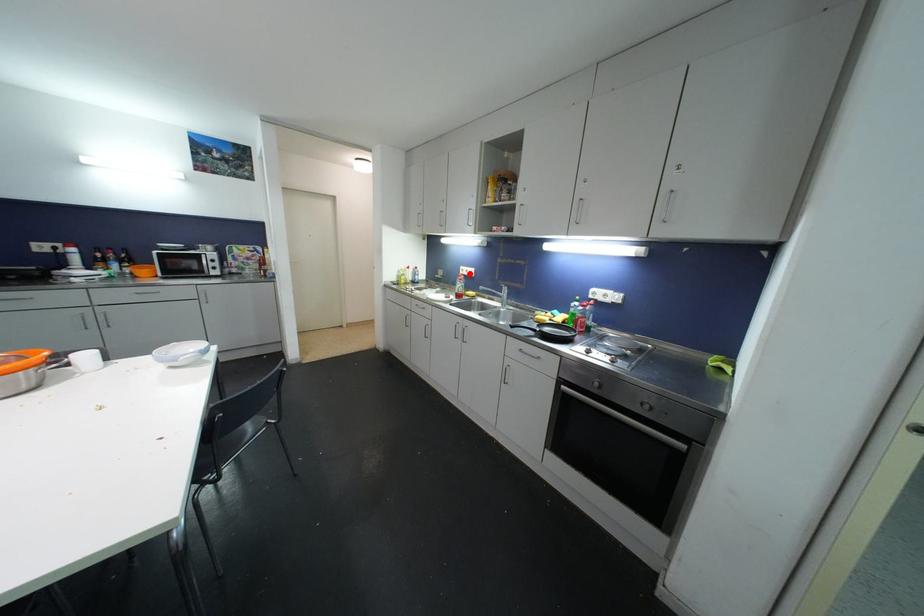
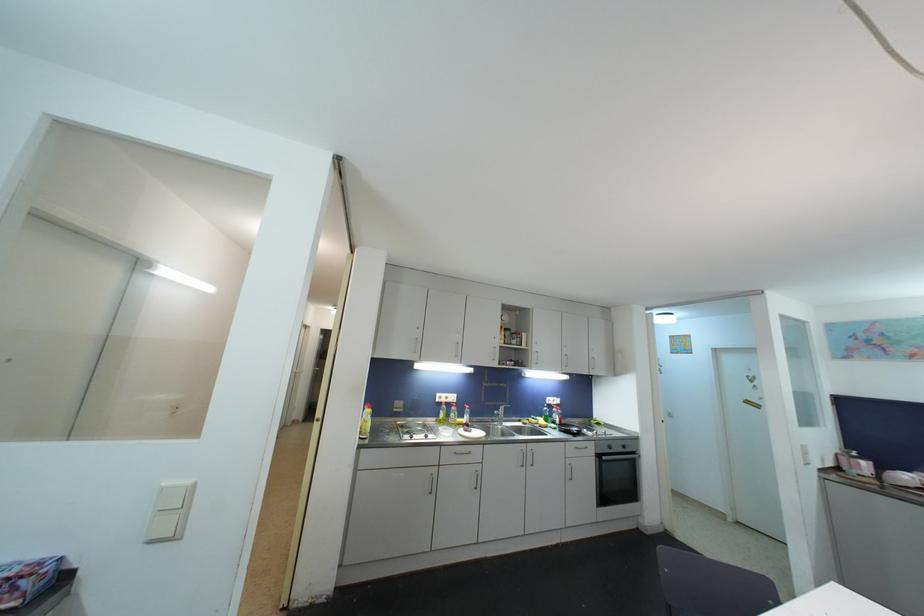
The point at the highlighted location is marked in the first image. Where is the corresponding point in the second image?

(450, 400)